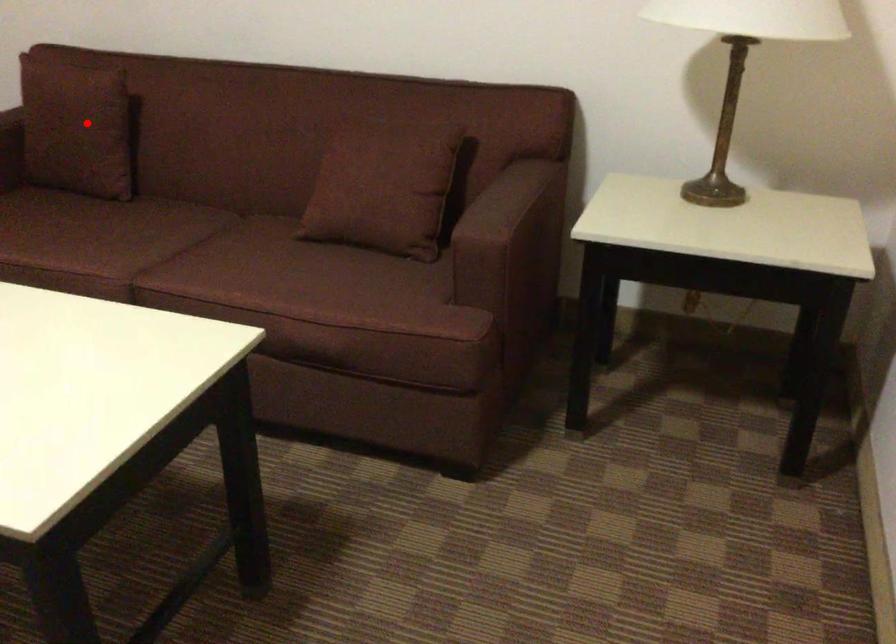
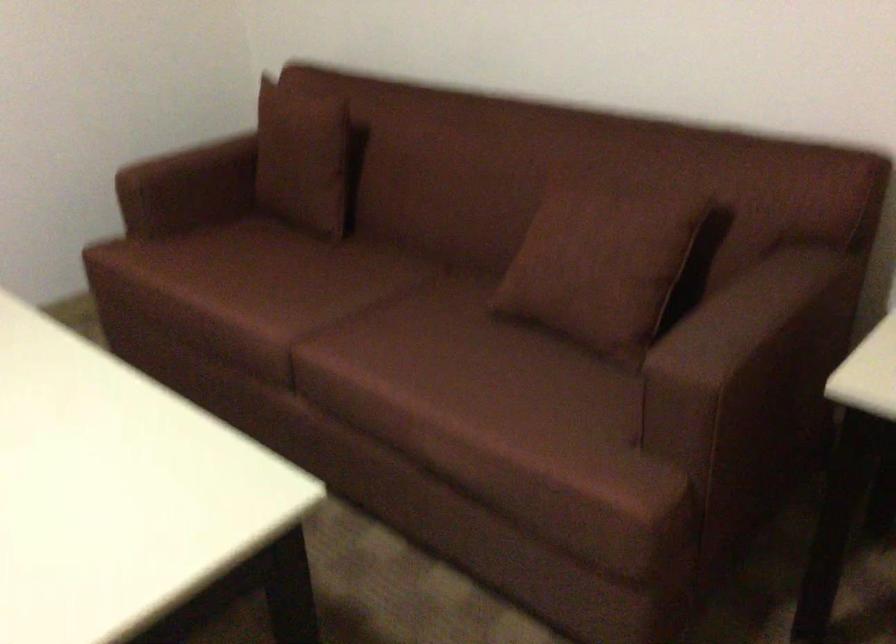
Locate, in the second image, the point that corresponds to the highlighted location in the first image.

(306, 158)